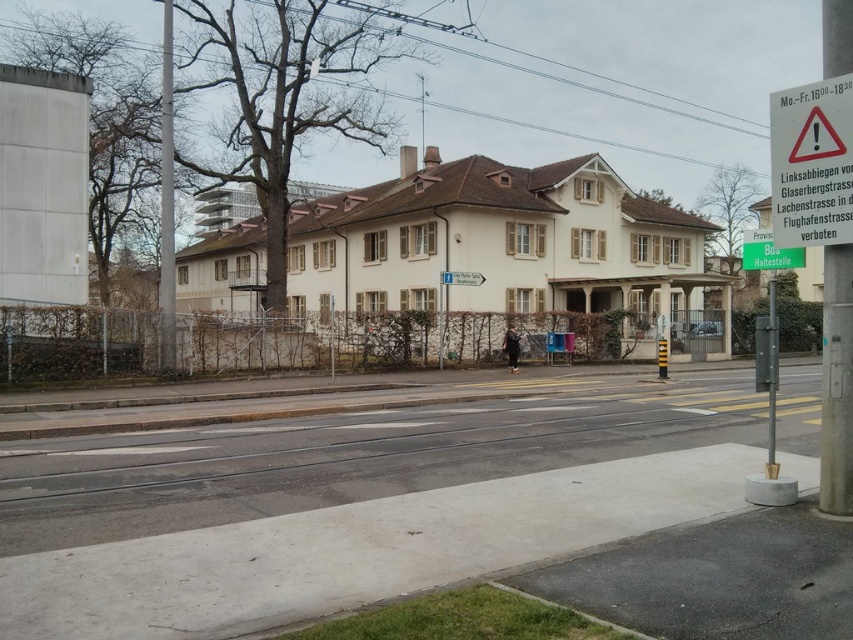
Is point (171, 288) closer to viewer compared to point (459, 282)?

That is True.

Who is more forward, (161, 168) or (457, 284)?

Point (457, 284)

Is point (161, 65) closer to viewer compared to point (477, 284)?

No, it is not.

Locate an element on the screen. metallic pole at left is located at coordinates (166, 200).

Describe the element at coordinates (811, 163) in the screenshot. I see `white plastic sign at upper right` at that location.

Between point (850, 188) and point (448, 276), which one is positioned in front?

Point (850, 188) is more forward.

Is point (816, 104) closer to viewer compared to point (476, 284)?

Yes, point (816, 104) is closer to viewer.

You are a GUI agent. You are given a task and a screenshot of the screen. Output one action in this format:
    pyautogui.click(x=<x>, y=<y>)
    Task: Click on the white plastic sign at upper right
    This screenshot has height=640, width=853.
    Given the screenshot: What is the action you would take?
    pyautogui.click(x=811, y=163)

Which is behind, point (828, 160) or point (161, 205)?

Point (161, 205)

Identify the location of white plastic sign at upper right. This screenshot has width=853, height=640. (811, 163).

Which is behind, point (833, 120) or point (167, 112)?

Point (167, 112)

Identify the location of white plastic sign at upper right. (x=811, y=163).